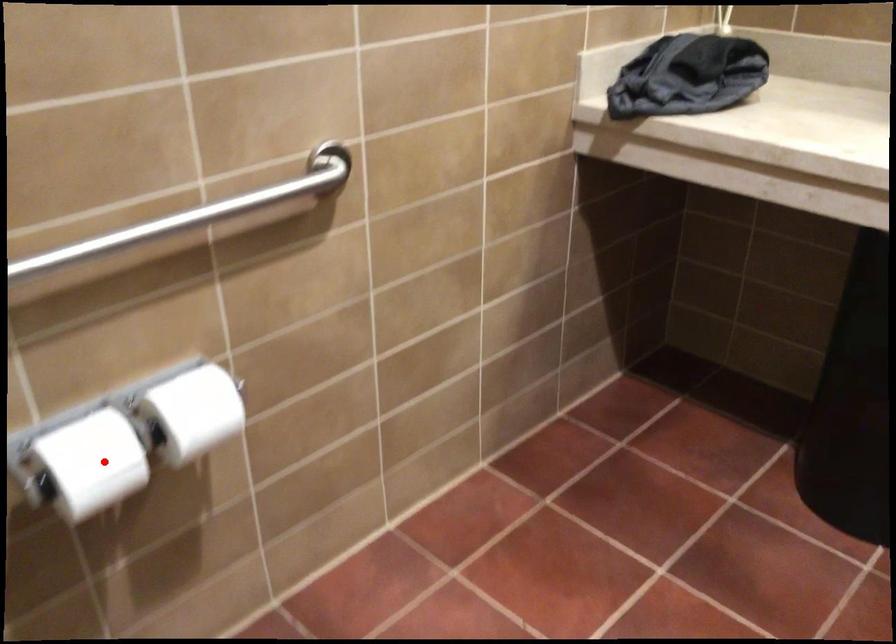
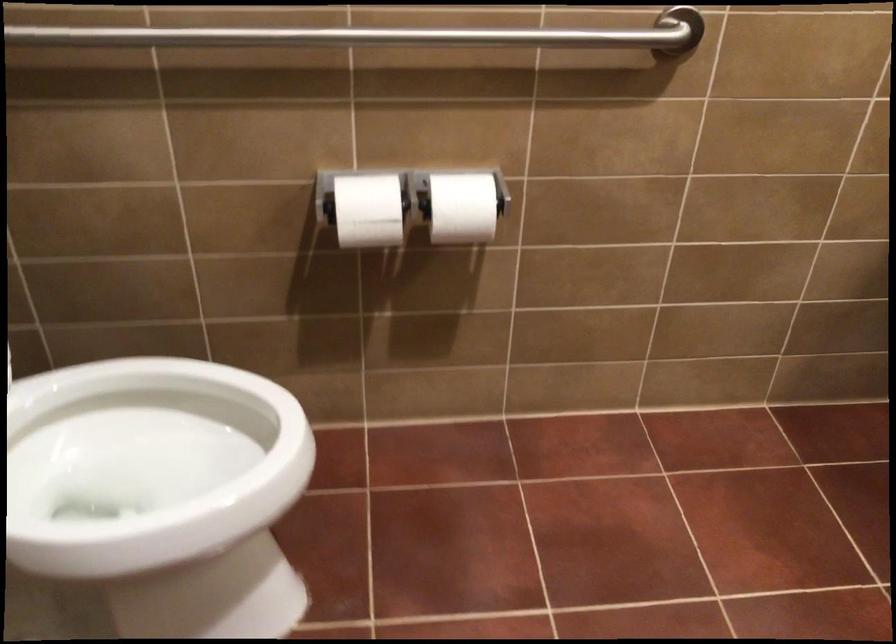
Question: I am providing you with two images of the same scene from different viewpoints. Image1 has a red point marked. In image2, the corresponding 3D location appears at what relative position? Reply with the corresponding letter.

Choices:
 (A) Closer
 (B) Farther

Answer: (B)